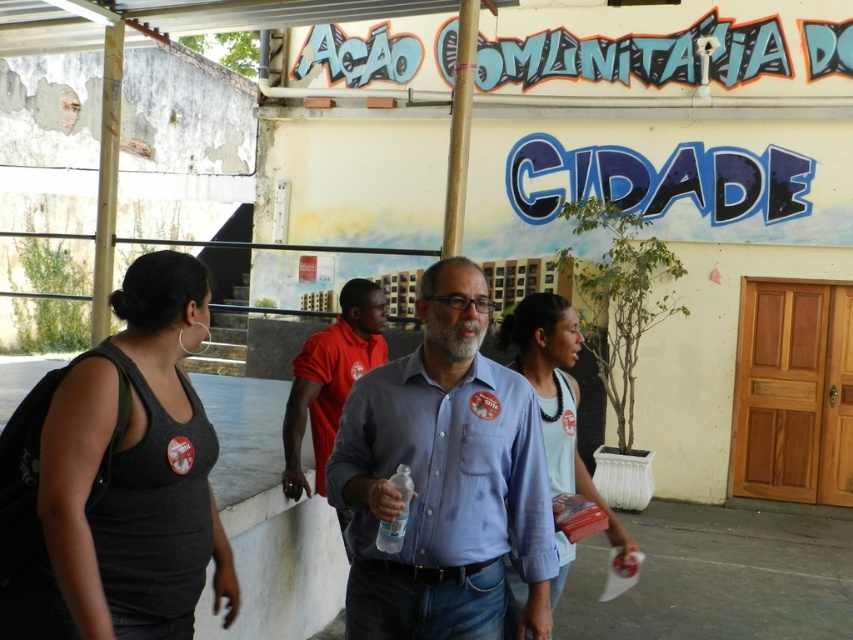
Is blue cotton shirt at center further to camera compared to light blue shirt at center?

No, blue cotton shirt at center is closer to the viewer.

Is point (515, 380) farther from viewer compared to point (622, 528)?

That is False.

Is point (453, 321) more distant than point (566, 301)?

No.

Locate an element on the screen. Image resolution: width=853 pixels, height=640 pixels. blue cotton shirt at center is located at coordinates (444, 477).

Does gray fabric tank top at left appear on the left side of red cotton shirt at center?

Indeed, gray fabric tank top at left is positioned on the left side of red cotton shirt at center.

Is point (183, 355) in front of point (315, 442)?

Yes, it is.

I want to click on gray fabric tank top at left, so click(129, 480).

Does gray fabric tank top at left come in front of light blue shirt at center?

Yes.

Is gray fabric tank top at left above light blue shirt at center?

Yes, gray fabric tank top at left is above light blue shirt at center.

This screenshot has width=853, height=640. I want to click on gray fabric tank top at left, so click(x=129, y=480).

Find the location of a particular element. gray fabric tank top at left is located at coordinates (129, 480).